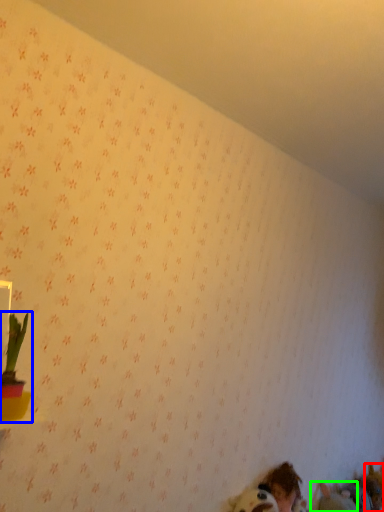
Question: Which object is the closest to the animal (highlighted by a red box)? Choose among these: houseplant (highlighted by a blue box) or animal (highlighted by a green box).

Choices:
 (A) houseplant
 (B) animal

Answer: (B)